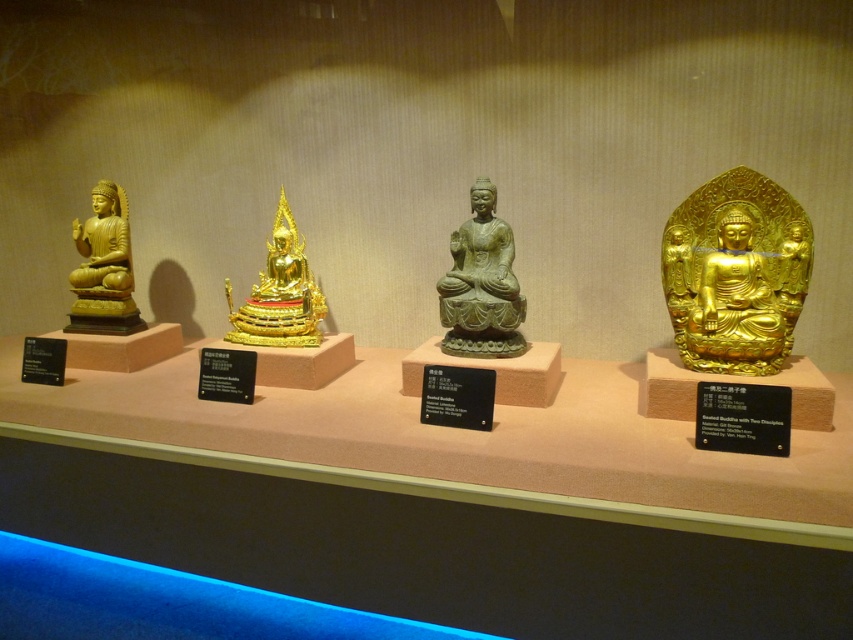
Question: Which point is farther to the camera?

Choices:
 (A) (447, 275)
 (B) (114, 188)
 (C) (764, 285)
 (D) (285, 307)

Answer: (B)

Question: Which object appears closest to the camera in this image?

Choices:
 (A) gold polished buddha at left
 (B) green stone buddha at center
 (C) gold/gilded/relief at right
 (D) gold polished buddha at center

Answer: (C)

Question: Can you confirm if gold/gilded/relief at right is thinner than gold polished buddha at left?

Choices:
 (A) no
 (B) yes

Answer: (A)

Question: Which point is closer to the camera?

Choices:
 (A) (117, 292)
 (B) (447, 333)

Answer: (B)

Question: Can you confirm if green stone buddha at center is wider than gold polished buddha at left?

Choices:
 (A) yes
 (B) no

Answer: (B)

Question: Is green stone buddha at center positioned behind gold polished buddha at left?

Choices:
 (A) yes
 (B) no

Answer: (B)